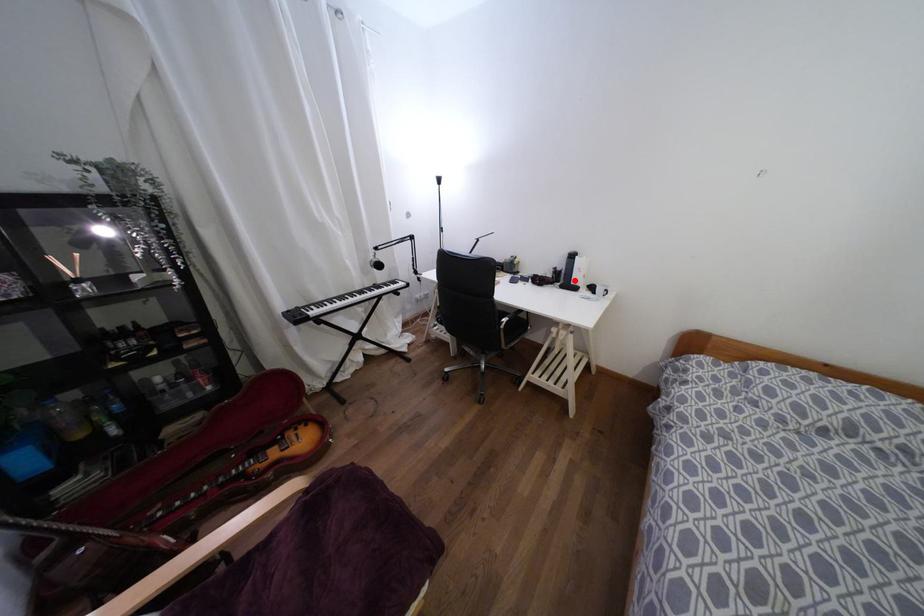
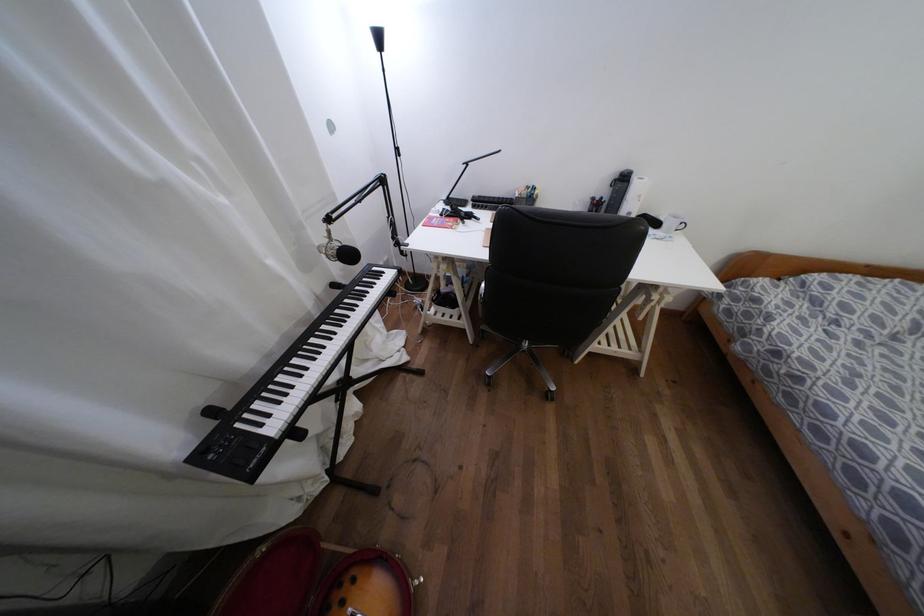
Question: I am providing you with two images of the same scene from different viewpoints. Image1 has a red point marked. In image2, the corresponding 3D location appears at what relative position? Reply with the corresponding letter.

Choices:
 (A) Closer
 (B) Farther

Answer: (B)